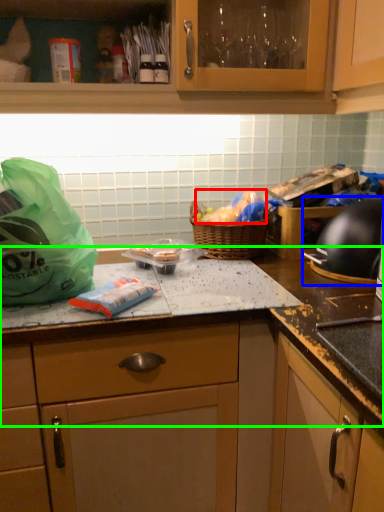
Question: Estimate the real-world distances between objects in this image. Which object is closer to food (highlighted by a red box), gas stove (highlighted by a blue box) or countertop (highlighted by a green box)?

Choices:
 (A) gas stove
 (B) countertop

Answer: (A)